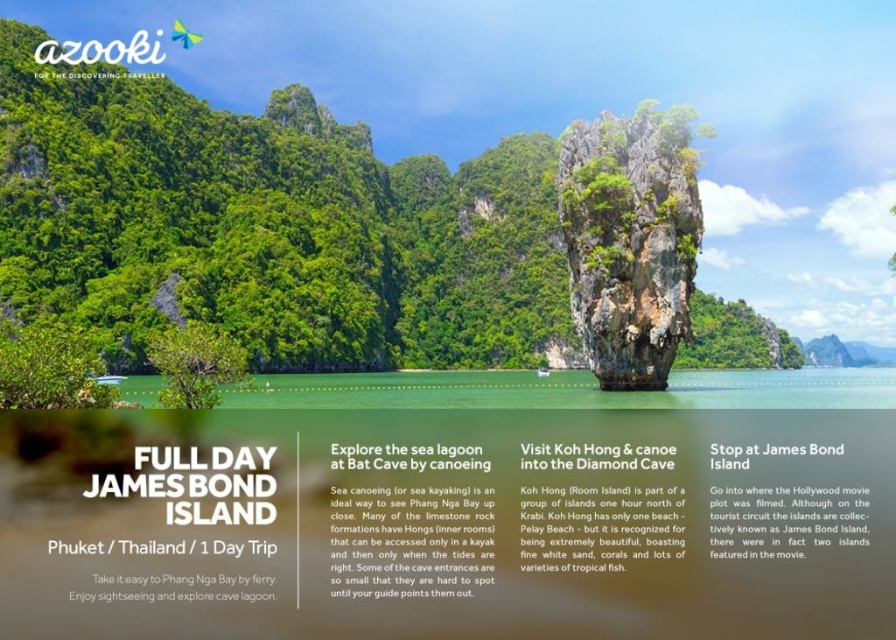
You are a tour guide explaining the image to tourists. Pointing to the clear blue water at center and the white paper text at center, you want to highlight their relative sizes. Which one is taller in the image?

The clear blue water at center is taller than the white paper text at center.

You are planning to swim from the clear blue water at center to the green textured rock formation at center. Given that the distance between them is 35.35 meters, and you can swim at a speed of 1.5 meters per second, how many seconds will it take you to reach the rock formation?

To calculate the time required to swim 35.35 meters at a speed of 1.5 meters per second, divide the distance by the speed. 35.35 divided by 1.5 equals approximately 23.57 seconds. Therefore, it will take about 23.6 seconds to reach the green textured rock formation at center.